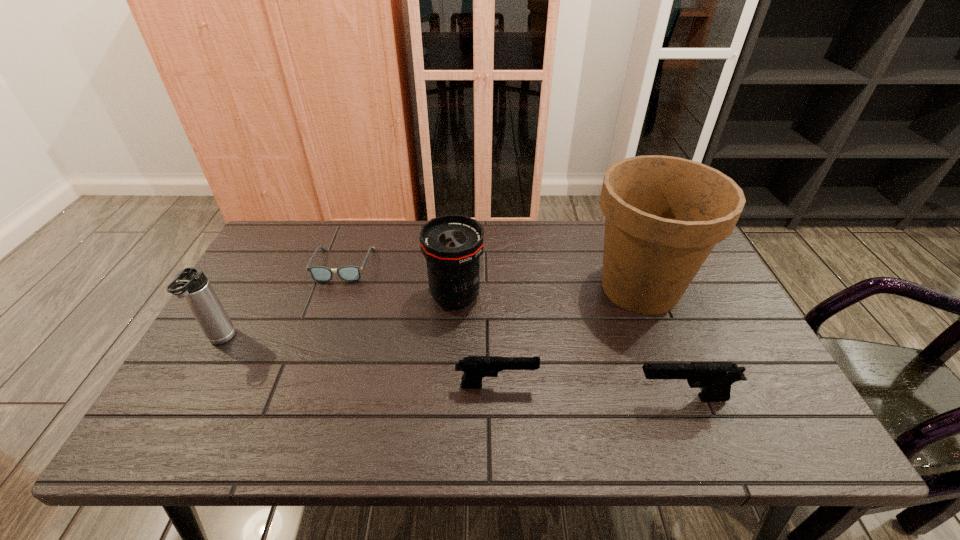
Locate an element on the screen. vacant place for an extra pistol on the left is located at coordinates (319, 374).